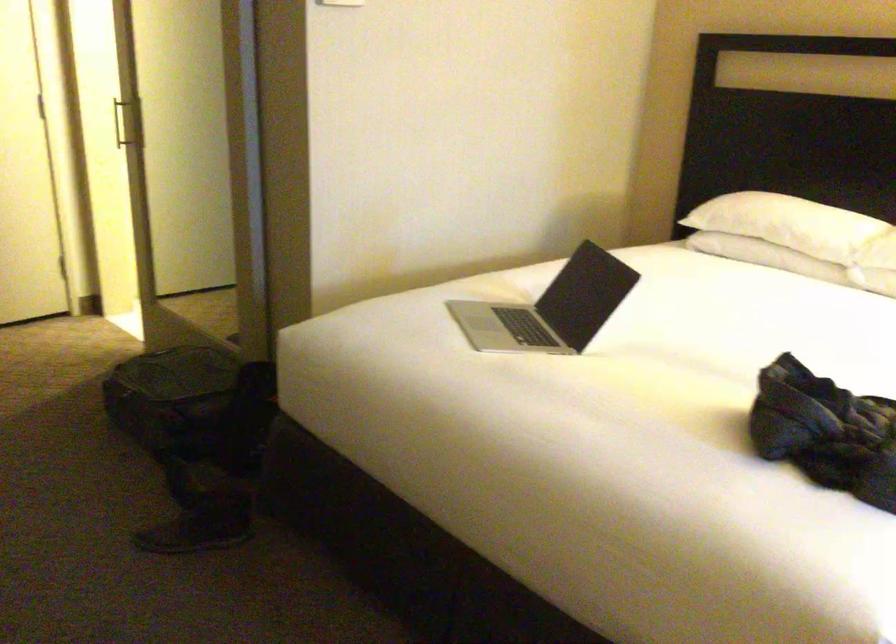
Where would you pull the door handle? Please return your answer as a coordinate pair (x, y).

(126, 122)